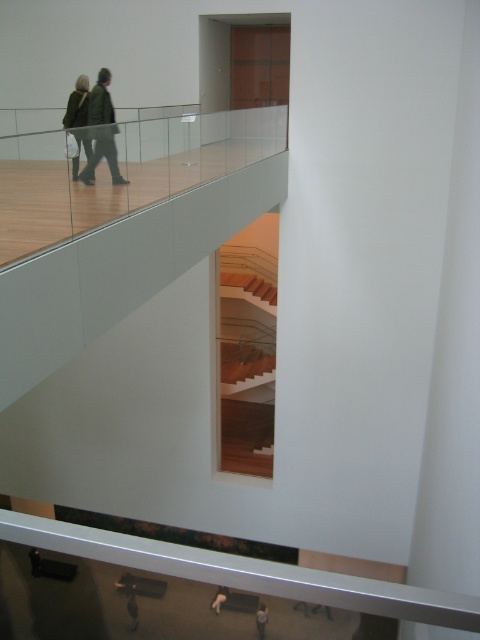
You are standing at the bottom of the staircase and want to find the person wearing the green fabric jacket at upper left. Which direction should you look relative to the white matte jacket at lower center?

The green fabric jacket at upper left is to the left of the white matte jacket at lower center, so you should look to the left of the white matte jacket at lower center to find the person wearing the green fabric jacket at upper left.

You are standing at the camera position and want to walk down the wooden stairs at center. How many steps will you take before reaching the bottom?

The wooden stairs at center is 36.00 feet away from camera. However, without knowing the height of each step or the total rise of the staircase, it is impossible to determine the exact number of steps required to reach the bottom.